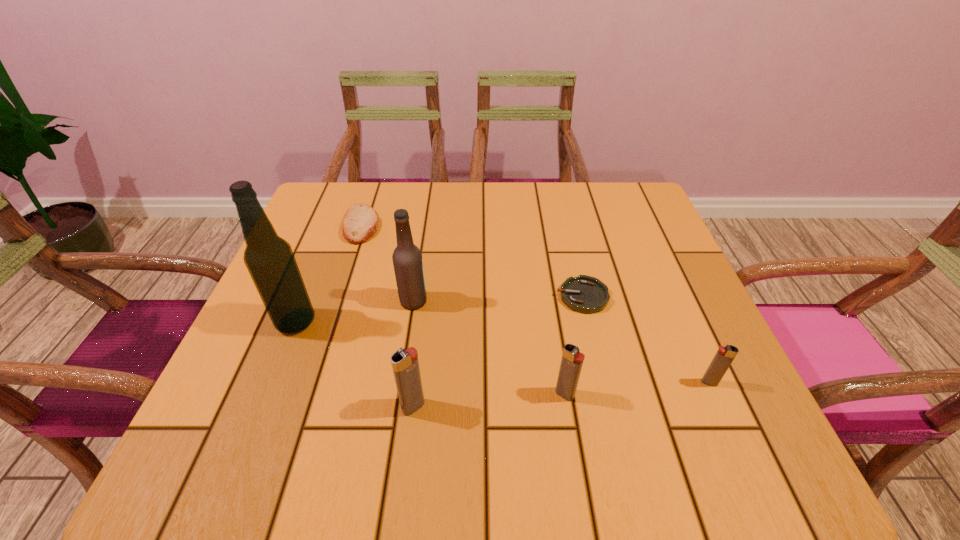
You are a GUI agent. You are given a task and a screenshot of the screen. Output one action in this format:
    pyautogui.click(x=<x>, y=<y>)
    Task: Click on the vacant region at the near right corner of the desktop
    This screenshot has width=960, height=540.
    Given the screenshot: What is the action you would take?
    pyautogui.click(x=674, y=394)

At what (x,y) coordinates should I click in order to perform the action: click on vacant space in between the second shortest igniter and the second tallest object. Please return your answer as a coordinate pair (x, y). This screenshot has height=540, width=960. Looking at the image, I should click on (489, 348).

At what (x,y) coordinates should I click in order to perform the action: click on free point between the fifth farthest object and the fourth shortest object. Please return your answer as a coordinate pair (x, y). The height and width of the screenshot is (540, 960). Looking at the image, I should click on (637, 388).

Find the location of `free spot between the tallest igniter and the third object from right to left`. free spot between the tallest igniter and the third object from right to left is located at coordinates (490, 401).

I want to click on free space between the alcohol and the sixth tallest object, so click(x=329, y=273).

The width and height of the screenshot is (960, 540). What are the coordinates of `vacant area between the sixth tallest object and the alcohol` in the screenshot? It's located at (329, 273).

Locate an element on the screen. vacant point located between the leftmost igniter and the second tallest igniter is located at coordinates (490, 401).

This screenshot has width=960, height=540. Find the location of `vacant area that lies between the fourth tallest object and the tallest igniter`. vacant area that lies between the fourth tallest object and the tallest igniter is located at coordinates (490, 401).

Where is `blank region between the tallest object and the second tallest object`? blank region between the tallest object and the second tallest object is located at coordinates (354, 312).

You are a GUI agent. You are given a task and a screenshot of the screen. Output one action in this format:
    pyautogui.click(x=<x>, y=<y>)
    Task: Click on the empty space between the shortest object and the sixth shortest object
    The width and height of the screenshot is (960, 540).
    Given the screenshot: What is the action you would take?
    pos(498,299)